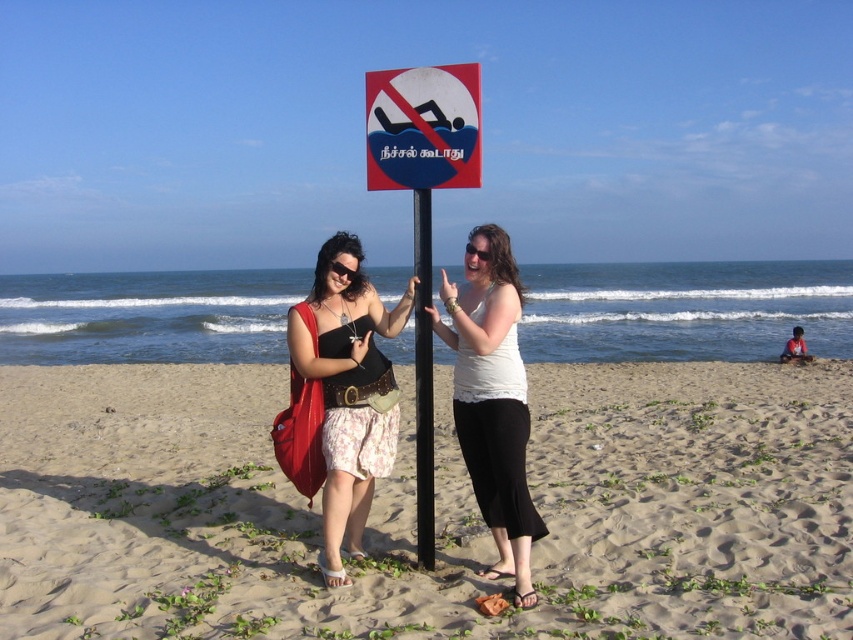
Is metallic signboard at center bigger than black metal pole at center?

Indeed, metallic signboard at center has a larger size compared to black metal pole at center.

The image size is (853, 640). Describe the element at coordinates (422, 209) in the screenshot. I see `metallic signboard at center` at that location.

Is point (440, 150) positioned in front of point (431, 358)?

Yes, it is in front of point (431, 358).

The width and height of the screenshot is (853, 640). I want to click on metallic signboard at center, so click(x=422, y=209).

Can you confirm if metallic signboard at center is positioned below blue plastic sign at center?

Yes.

You are a GUI agent. You are given a task and a screenshot of the screen. Output one action in this format:
    pyautogui.click(x=<x>, y=<y>)
    Task: Click on the metallic signboard at center
    The width and height of the screenshot is (853, 640).
    Given the screenshot: What is the action you would take?
    pyautogui.click(x=422, y=209)

At what (x,y) coordinates should I click in order to perform the action: click on metallic signboard at center. Please return your answer as a coordinate pair (x, y). The image size is (853, 640). Looking at the image, I should click on (422, 209).

Is matte black top at center positioned in front of blue plastic sign at center?

Yes, matte black top at center is in front of blue plastic sign at center.

Which is in front, point (343, 410) or point (373, 150)?

Positioned in front is point (343, 410).

You are a GUI agent. You are given a task and a screenshot of the screen. Output one action in this format:
    pyautogui.click(x=<x>, y=<y>)
    Task: Click on the matte black top at center
    
    Given the screenshot: What is the action you would take?
    pyautogui.click(x=347, y=390)